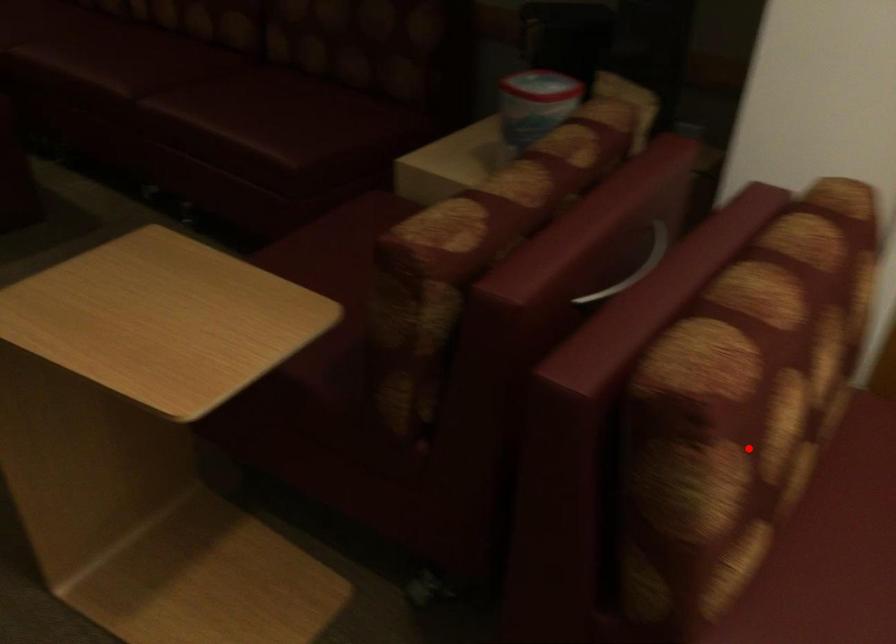
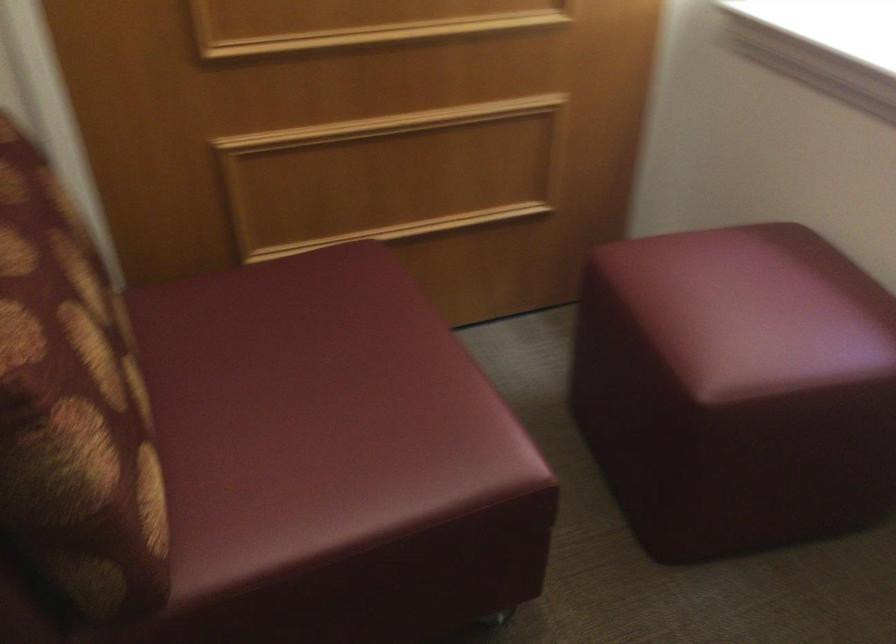
Question: I am providing you with two images of the same scene from different viewpoints. A red point is shown in image1. For the corresponding object point in image2, is it positioned nearer or farther from the camera?

Choices:
 (A) Nearer
 (B) Farther

Answer: (A)